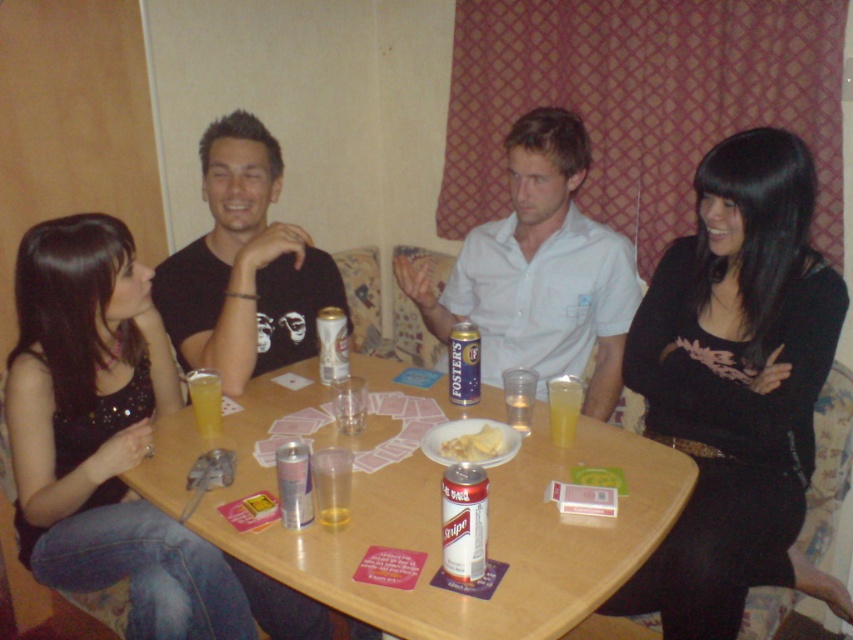
Looking at this image, you are a bartender who needs to place a new drink order. The table has a gold foil can at table center. Where exactly should you place the new drink to match the existing arrangement?

The gold foil can at table center is located at point (463, 364), so place the new drink near that coordinate to maintain the arrangement.

You are taking a photo of the table and want to focus on both point [329,490] and point [200,412]. Which point should you adjust your focus on first to ensure both are in sharp view?

Point [329,490] is closer to the camera than point [200,412], so you should focus on point [329,490] first to ensure both are in sharp view.

You are at a social gathering and want to grab a drink. You see a gold foil can at table center and a translucent glass at table center. Which one is more to the right?

The gold foil can at table center is more to the right.